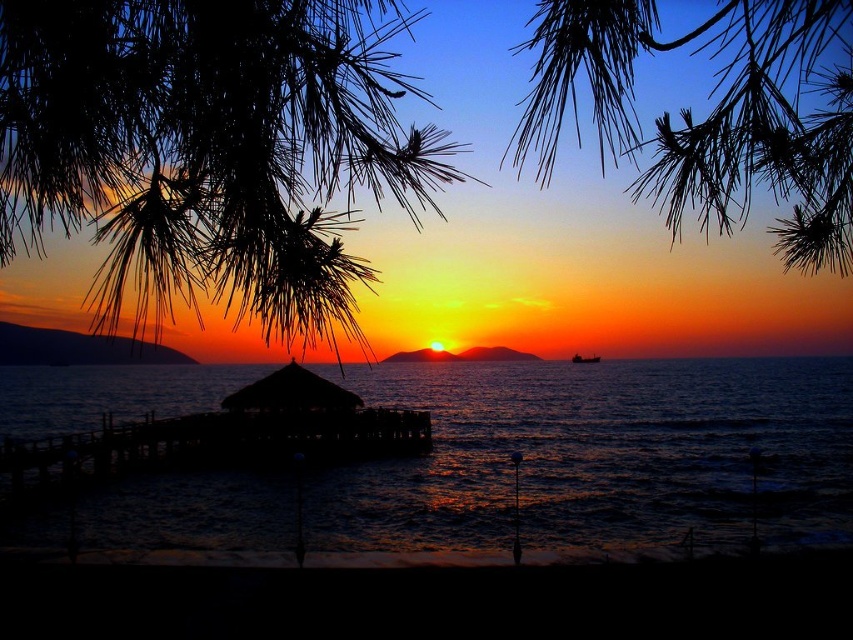
Between dark blue water at center and metallic gray ship at center, which one has more height?

Standing taller between the two is dark blue water at center.

Which is behind, point (126, 486) or point (596, 355)?

The point (596, 355) is more distant.

The image size is (853, 640). Identify the location of dark blue water at center. (599, 454).

From the picture: How distant is green needle-like leaves at center from silhouette thatched hut at center?

green needle-like leaves at center and silhouette thatched hut at center are 26.89 meters apart.

Is green needle-like leaves at center further to the viewer compared to silhouette thatched hut at center?

No, green needle-like leaves at center is in front of silhouette thatched hut at center.

Does point (225, 305) come closer to viewer compared to point (316, 392)?

Yes, point (225, 305) is in front of point (316, 392).

At what (x,y) coordinates should I click in order to perform the action: click on green needle-like leaves at center. Please return your answer as a coordinate pair (x, y). Looking at the image, I should click on (212, 150).

Is silhouette thatched hut at center shorter than metallic gray ship at center?

Incorrect, silhouette thatched hut at center's height does not fall short of metallic gray ship at center's.

Locate an element on the screen. silhouette thatched hut at center is located at coordinates (291, 392).

This screenshot has height=640, width=853. I want to click on silhouette thatched hut at center, so click(291, 392).

Locate an element on the screen. silhouette thatched hut at center is located at coordinates (291, 392).